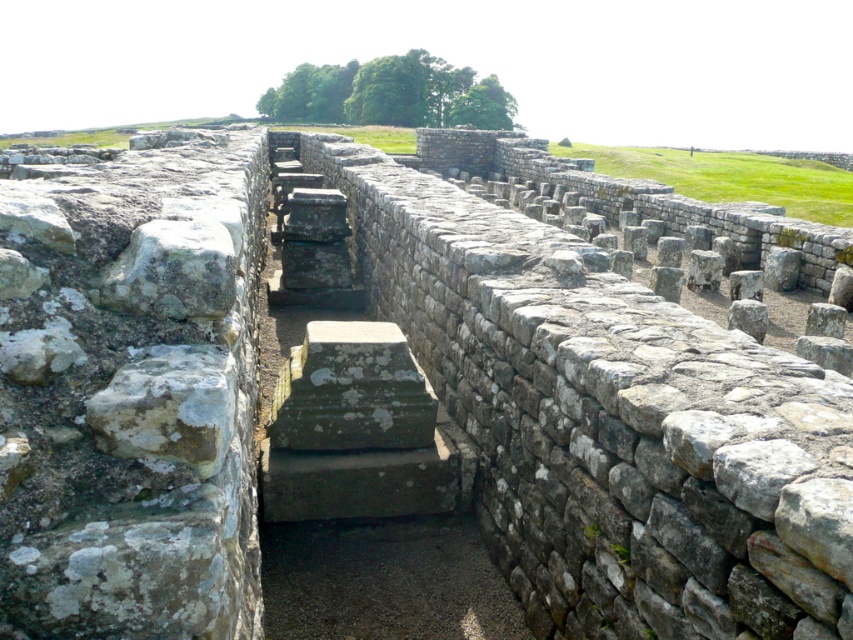
You are an archaeologist examining the ancient stone structure. You notice two weathered stone features in the corridor between the walls. Which one is shorter between the weathered stone wall at left and the weathered stone at left?

The weathered stone wall at left is shorter than the weathered stone at left.

You are an archaeologist exploring the ancient site. You notice the gray stone stairs at center and the weathered stone at left. Which object is positioned higher in elevation?

The gray stone stairs at center is above the weathered stone at left, so it is positioned higher in elevation.